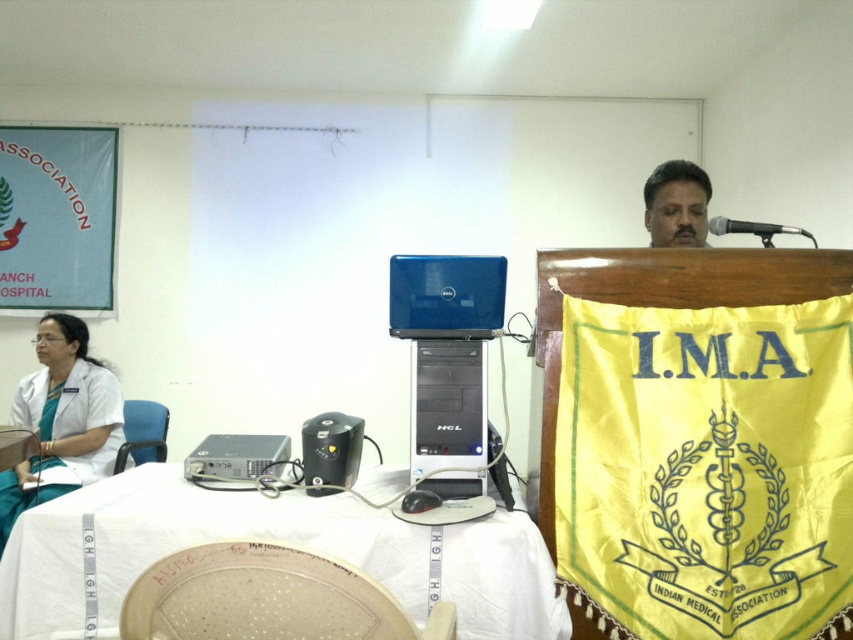
What do you see at coordinates (265, 540) in the screenshot? Image resolution: width=853 pixels, height=640 pixels. I see `white plastic table at center` at bounding box center [265, 540].

Is white plastic table at center shorter than matte black laptop at upper center?

Indeed, white plastic table at center has a lesser height compared to matte black laptop at upper center.

Between point (537, 621) and point (648, 188), which one is positioned behind?

The point (648, 188) is more distant.

Locate an element on the screen. The height and width of the screenshot is (640, 853). white plastic table at center is located at coordinates (265, 540).

Does white cloth at left have a lesser height compared to matte black laptop at upper center?

No.

Does white cloth at left appear on the left side of matte black laptop at upper center?

Yes, white cloth at left is to the left of matte black laptop at upper center.

Measure the distance between white cloth at left and camera.

The distance of white cloth at left from camera is 2.44 meters.

Where is `white cloth at left`? Image resolution: width=853 pixels, height=640 pixels. white cloth at left is located at coordinates (61, 420).

Between white plastic table at center and metallic at upper right, which one appears on the right side from the viewer's perspective?

metallic at upper right is more to the right.

Locate an element on the screen. white plastic table at center is located at coordinates (265, 540).

Image resolution: width=853 pixels, height=640 pixels. What are the coordinates of `white plastic table at center` in the screenshot? It's located at [x=265, y=540].